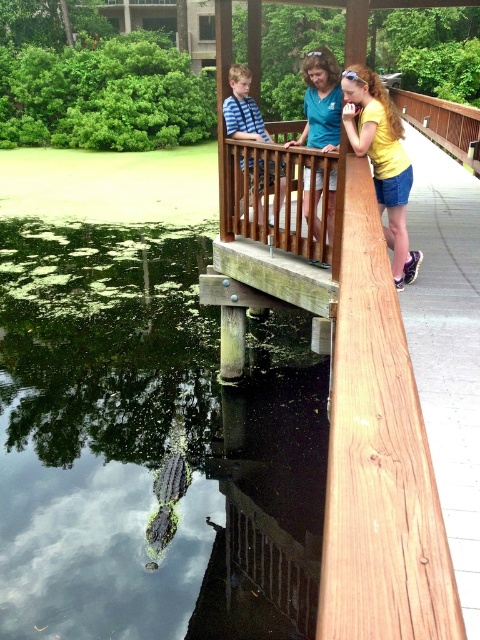
Question: Which point appears closest to the camera in this image?

Choices:
 (A) (326, 150)
 (B) (305, 538)
 (C) (384, 168)

Answer: (C)

Question: Estimate the real-world distances between objects in this image. Which object is farther from the green algae water at lower left?

Choices:
 (A) striped cotton shirt at upper center
 (B) yellow matte shirt at upper right

Answer: (B)

Question: Does matte blue shirt at upper center have a lesser width compared to striped cotton shirt at upper center?

Choices:
 (A) no
 (B) yes

Answer: (B)

Question: Observing the image, what is the correct spatial positioning of wooden railing at upper center in reference to yellow matte shirt at upper right?

Choices:
 (A) above
 (B) below

Answer: (A)

Question: Which object is the closest to the matte blue shirt at upper center?

Choices:
 (A) green algae water at lower left
 (B) yellow matte shirt at upper right
 (C) wooden railing at upper center
 (D) striped cotton shirt at upper center

Answer: (D)

Question: Can you confirm if matte blue shirt at upper center is positioned below striped cotton shirt at upper center?

Choices:
 (A) no
 (B) yes

Answer: (A)